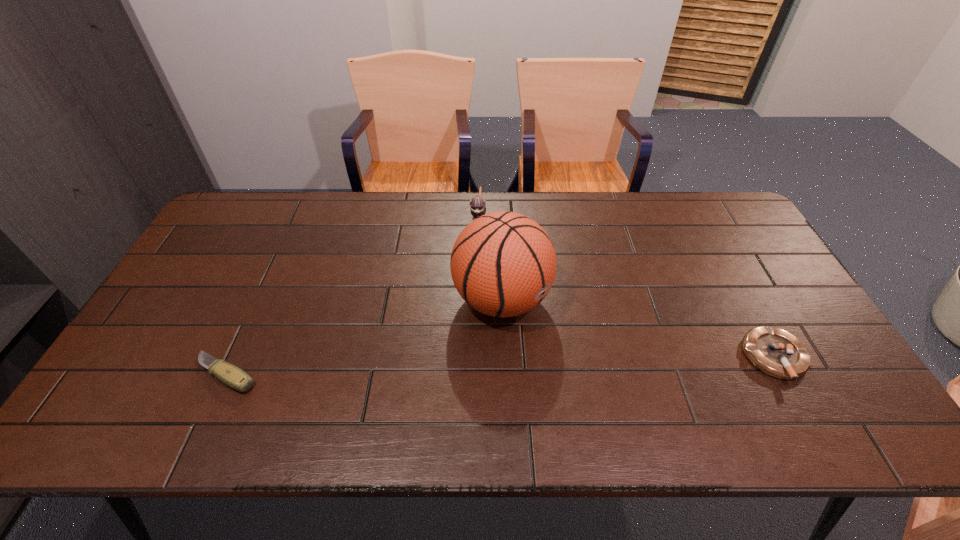
Image resolution: width=960 pixels, height=540 pixels. In the image, there is a desktop. In order to click on vacant space at the far edge in this screenshot , I will do (394, 231).

Where is `vacant position at the near edge of the desktop`? The height and width of the screenshot is (540, 960). vacant position at the near edge of the desktop is located at coordinates (615, 370).

Find the location of a particular element. vacant region at the left edge is located at coordinates (177, 316).

Where is `vacant space at the far left corner of the desktop`? Image resolution: width=960 pixels, height=540 pixels. vacant space at the far left corner of the desktop is located at coordinates (252, 226).

In order to click on free space between the ashtray and the pocketknife in this screenshot , I will do `click(501, 366)`.

Find the location of a particular element. This screenshot has height=540, width=960. unoccupied area between the third shortest object and the rightmost object is located at coordinates (627, 286).

This screenshot has height=540, width=960. I want to click on free area in between the ashtray and the leftmost object, so click(x=501, y=366).

Where is `free spot between the second shortest object and the leftmost object`? free spot between the second shortest object and the leftmost object is located at coordinates (501, 366).

Image resolution: width=960 pixels, height=540 pixels. I want to click on free space between the third shortest object and the ashtray, so click(627, 286).

Find the location of `unoccupied area between the basketball and the shortest object`. unoccupied area between the basketball and the shortest object is located at coordinates (364, 336).